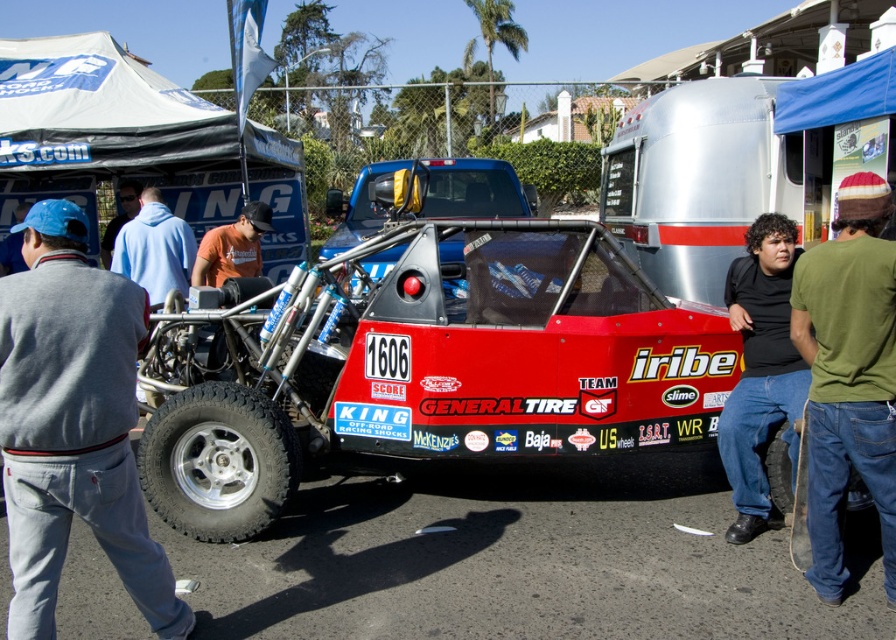
Is black rubber tire at lower left to the right of light blue hoodie at left from the viewer's perspective?

Correct, you'll find black rubber tire at lower left to the right of light blue hoodie at left.

Looking at this image, who is lower down, black rubber tire at lower left or light blue hoodie at left?

black rubber tire at lower left is below.

Find the location of a particular element. black rubber tire at lower left is located at coordinates 218,461.

Can you confirm if gray fleece jacket at left is positioned to the right of black matte shirt at center?

Incorrect, gray fleece jacket at left is not on the right side of black matte shirt at center.

Who is higher up, gray fleece jacket at left or black matte shirt at center?

black matte shirt at center

What do you see at coordinates (73, 424) in the screenshot? I see `gray fleece jacket at left` at bounding box center [73, 424].

The image size is (896, 640). I want to click on gray fleece jacket at left, so click(73, 424).

Does light blue hoodie at left have a smaller size compared to orange fabric shirt at center?

No, light blue hoodie at left is not smaller than orange fabric shirt at center.

Is light blue hoodie at left closer to camera compared to orange fabric shirt at center?

That is False.

Does point (131, 276) lie in front of point (229, 262)?

No.

The image size is (896, 640). Identify the location of light blue hoodie at left. (154, 248).